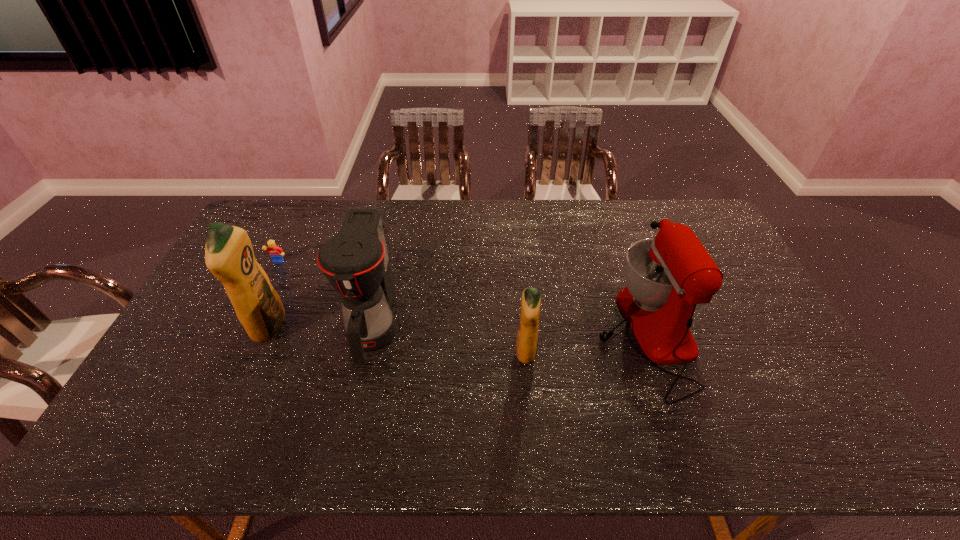
In order to click on empty location between the mixer and the coffee maker in this screenshot , I will do `click(509, 330)`.

Locate an element on the screen. The height and width of the screenshot is (540, 960). the second closest object to the shortest object is located at coordinates (275, 252).

Identify which object is located as the second nearest to the fourth tallest object. Please provide its 2D coordinates. Your answer should be formatted as a tuple, i.e. [(x, y)], where the tuple contains the x and y coordinates of a point satisfying the conditions above.

[(355, 261)]